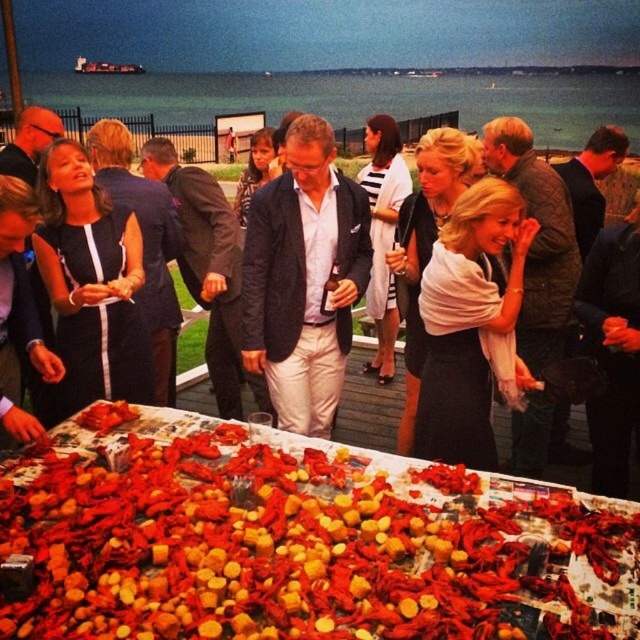
You are a guest at the event and want to take a photo of the shiny red crayfish at center and the matte black dress at center. Which object should you focus on first to ensure both are in the frame?

The shiny red crayfish at center is located below the matte black dress at center. Since the dress is above the crayfish, you should focus on the matte black dress at center first to ensure both are in the frame.

You are a photographer standing at the center of the scene. You want to take a photo of the shiny red crayfish at center. Where should you aim your camera to capture it in the frame?

You should aim your camera at the point with coordinates 0.845 on the x axis and 0.467 on the y axis to capture the shiny red crayfish at center.

You are standing at the edge of the waterfront and see two points in the scene. The first point is at coordinates point (321, 582) and the second is at point (308, 243). Which point is closer to you?

Point (321, 582) is closer to the viewer than point (308, 243).